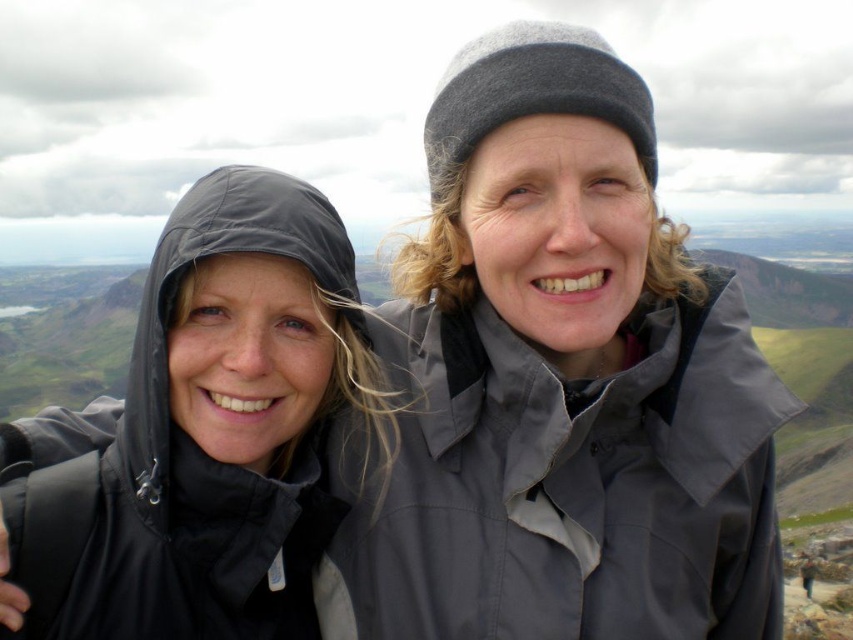
Based on the photo, you are planning to take a photo of the two people in the scene. The matte gray jacket at center and the matte black raincoat at left are both in your camera frame. If you want to ensure that both are fully visible in the photo, which one should you focus on to adjust the framing?

You should focus on the matte gray jacket at center because it is taller than the matte black raincoat at left, so adjusting the framing to accommodate its height will ensure both are fully visible.

You are planning to take a photo of the two people wearing the matte gray jacket at center and the matte black raincoat at left. If you want to ensure both are fully visible in the frame, which person should stand closer to the camera?

The matte black raincoat at left should stand closer to the camera because the matte gray jacket at center might be wider and thus requires more space to fit into the frame.

In the image, there are two people standing on a mountain. The person on the left is wearing a dark hooded jacket, and the person on the right is wearing a gray jacket with a darker inner. There is a point marked at coordinates (560, 381). Which object does this point correspond to?

The point at (560, 381) marks the matte gray jacket at center.